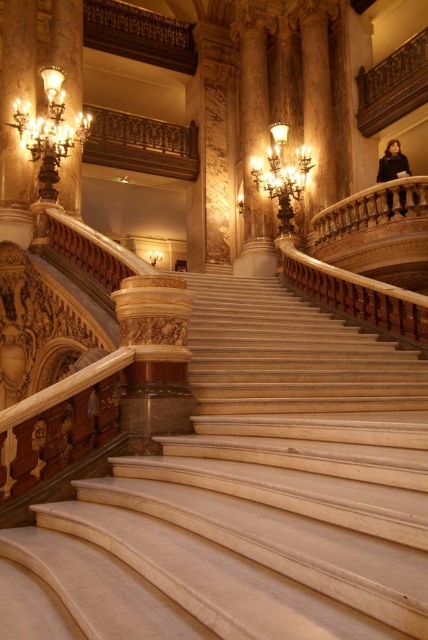
Question: Does matte bronze sconce at upper left have a lesser width compared to gold metallic chandelier at upper center?

Choices:
 (A) no
 (B) yes

Answer: (B)

Question: Which is farther from the gold metallic chandelier at upper left?

Choices:
 (A) carved wood balustrade at upper center
 (B) gold metallic chandelier at upper center

Answer: (B)

Question: Does carved wood balustrade at upper center appear under gold metallic chandelier at upper center?

Choices:
 (A) yes
 (B) no

Answer: (B)

Question: Is carved wood balustrade at upper center thinner than gold metallic chandelier at upper center?

Choices:
 (A) yes
 (B) no

Answer: (A)

Question: Which of the following is the farthest from the observer?

Choices:
 (A) (55, 180)
 (B) (284, 205)

Answer: (B)

Question: Which point is closer to the camera?

Choices:
 (A) gold metallic chandelier at upper left
 (B) matte bronze sconce at upper left

Answer: (A)